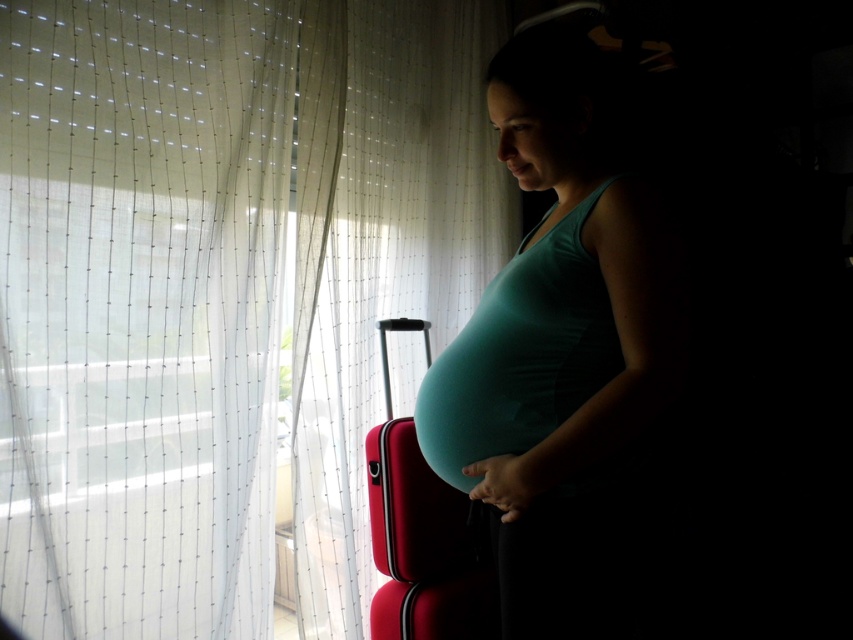
Question: From the image, what is the correct spatial relationship of white sheer curtain at left in relation to matte teal tank top at center?

Choices:
 (A) right
 (B) left

Answer: (B)

Question: Can you confirm if matte teal tank top at center is positioned to the left of matte red suitcase at center?

Choices:
 (A) yes
 (B) no

Answer: (B)

Question: Is matte teal tank top at center bigger than matte red suitcase at center?

Choices:
 (A) no
 (B) yes

Answer: (B)

Question: Which point is closer to the camera taking this photo?

Choices:
 (A) (521, 529)
 (B) (456, 618)
 (C) (41, 492)
 (D) (407, 454)

Answer: (A)

Question: Which of the following is the closest to the observer?

Choices:
 (A) matte teal tank top at center
 (B) white sheer curtain at left
 (C) matte red suitcase at lower center
 (D) matte red suitcase at center

Answer: (A)

Question: Which point appears closest to the camera in this image?

Choices:
 (A) (378, 321)
 (B) (158, 292)
 (C) (543, 397)

Answer: (C)